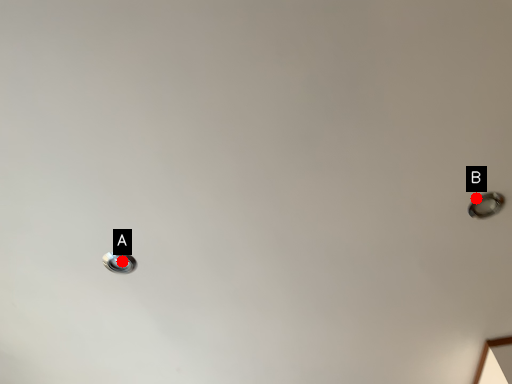
Question: Two points are circled on the image, labeled by A and B beside each circle. Among these points, which one is farthest from the camera?

Choices:
 (A) A is further
 (B) B is further

Answer: (A)